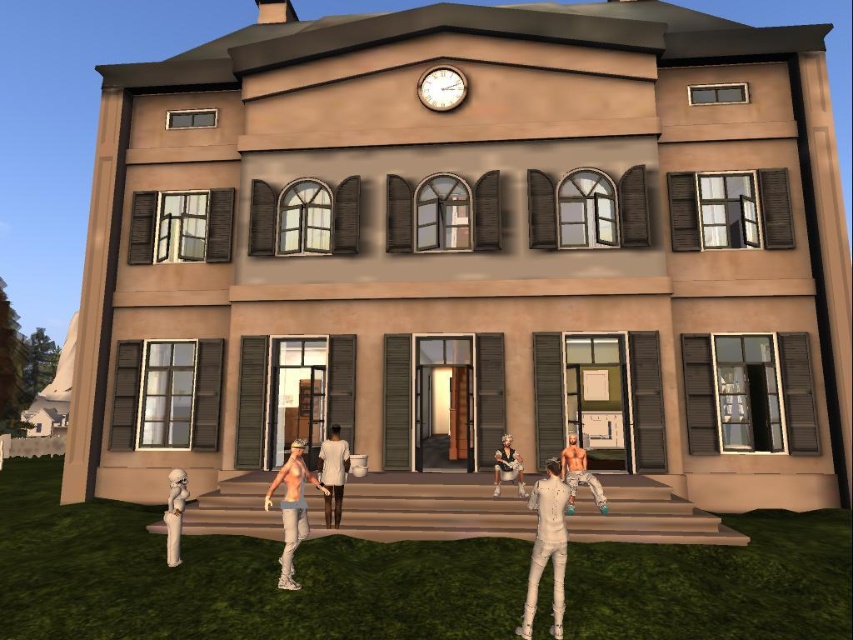
Does point (326, 474) lie in front of point (508, 467)?

Yes, point (326, 474) is closer to viewer.

The image size is (853, 640). I want to click on white matte dress at center, so click(x=334, y=474).

Can you confirm if white matte shirt at center is taller than wooden clock at upper center?

Yes.

Which is behind, point (300, 525) or point (453, 84)?

The point (453, 84) is behind.

What are the coordinates of `white matte shirt at center` in the screenshot? It's located at (292, 508).

Is wooden clock at upper center further to the viewer compared to white glossy pipe at lower left?

Yes.

Between wooden clock at upper center and white glossy pipe at lower left, which one appears on the right side from the viewer's perspective?

wooden clock at upper center is more to the right.

You are a GUI agent. You are given a task and a screenshot of the screen. Output one action in this format:
    pyautogui.click(x=<x>, y=<y>)
    Task: Click on the wooden clock at upper center
    
    Given the screenshot: What is the action you would take?
    pyautogui.click(x=440, y=88)

In order to click on wooden clock at upper center in this screenshot , I will do `click(440, 88)`.